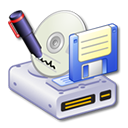
This screenshot has width=128, height=128. In order to click on silver sliding mechanism in this screenshot , I will do `click(93, 70)`.